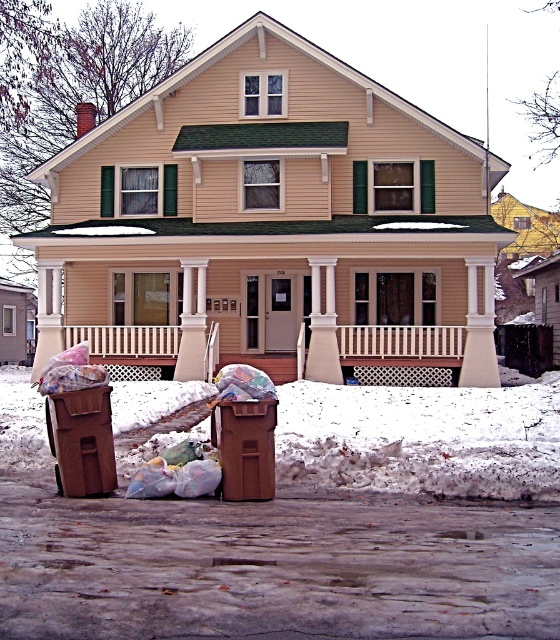
Does point (348, 442) come farther from viewer compared to point (198, 339)?

No, (348, 442) is in front of (198, 339).

Is white fluffy snow at lower center closer to the viewer compared to white wood column at center?

Yes, it is in front of white wood column at center.

Is point (399, 412) behind point (176, 376)?

No.

Image resolution: width=560 pixels, height=640 pixels. I want to click on white fluffy snow at lower center, so click(422, 438).

Measure the distance between point (x=207, y=484) and camera.

Point (x=207, y=484) and camera are 32.94 feet apart.

Between translucent plastic bags at lower center and white wood column at center, which one appears on the right side from the viewer's perspective?

From the viewer's perspective, translucent plastic bags at lower center appears more on the right side.

This screenshot has width=560, height=640. Find the location of `translucent plastic bags at lower center`. translucent plastic bags at lower center is located at coordinates (178, 472).

Locate an element on the screen. white wood column at center is located at coordinates (193, 323).

Is the position of white wood column at center less distant than that of translucent plastic bags at lower left?

No, white wood column at center is further to the viewer.

Between point (200, 296) and point (84, 362), which one is positioned in front?

Point (84, 362)

Identify the location of white wood column at center. (193, 323).